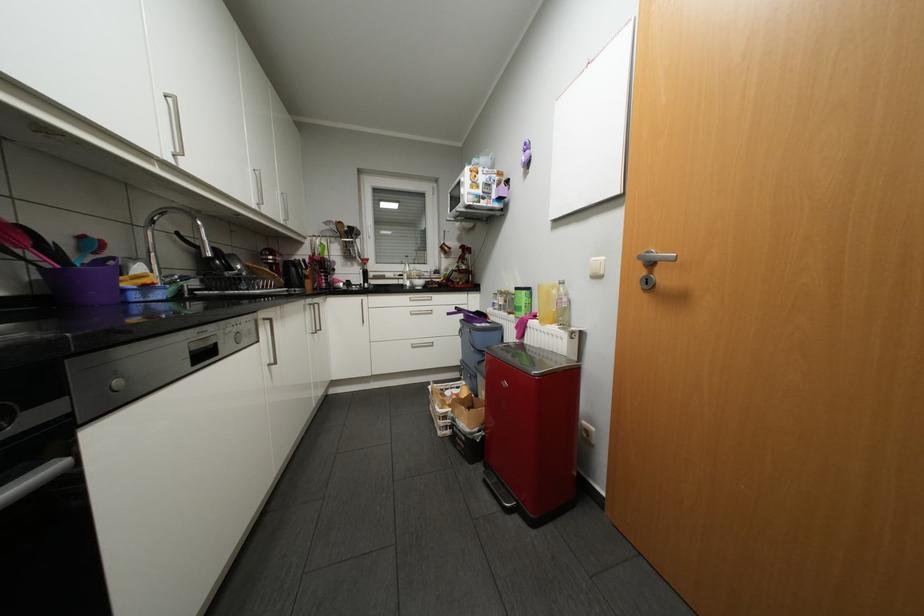
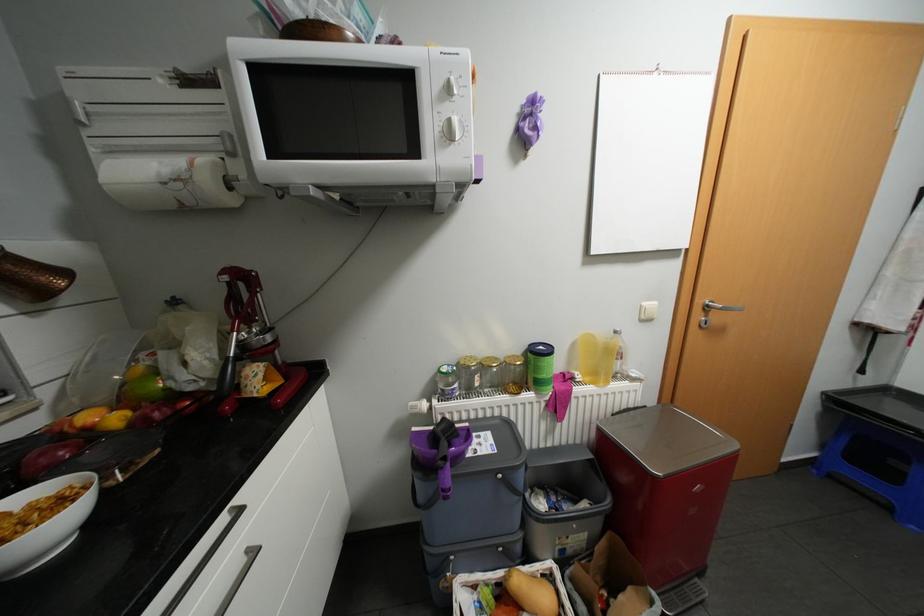
The point at [428,282] is marked in the first image. Where is the corresponding point in the second image?

(44, 522)